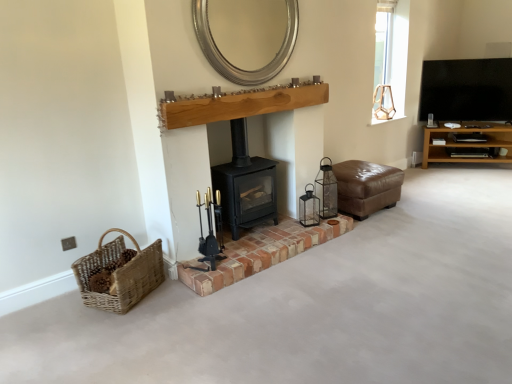
Question: Considering the positions of metallic lantern at center, marked as the 1th candle holder in a right-to-left arrangement, and natural wood mantle at center in the image, is metallic lantern at center, marked as the 1th candle holder in a right-to-left arrangement, taller or shorter than natural wood mantle at center?

Choices:
 (A) tall
 (B) short

Answer: (A)

Question: Is metallic lantern at center, which is the second candle holder from left to right, situated inside natural wood mantle at center or outside?

Choices:
 (A) inside
 (B) outside

Answer: (B)

Question: Which of these objects is positioned farthest from the brown wooden shelf at right?

Choices:
 (A) black glossy tv at upper right
 (B) red brick fireplace at center
 (C) black metal fireplace tools at center, which is the first candle holder from front to back
 (D) natural wood mantle at center
 (E) metallic lantern at center, the second candle holder in the front-to-back sequence

Answer: (C)

Question: Estimate the real-world distances between objects in this image. Which object is farther from the black glossy tv at upper right?

Choices:
 (A) brown wooden shelf at right
 (B) black matte wood burning stove at center
 (C) clear glass window at upper right
 (D) woven natural basket at lower left
 (E) silver metallic mirror at upper center

Answer: (D)